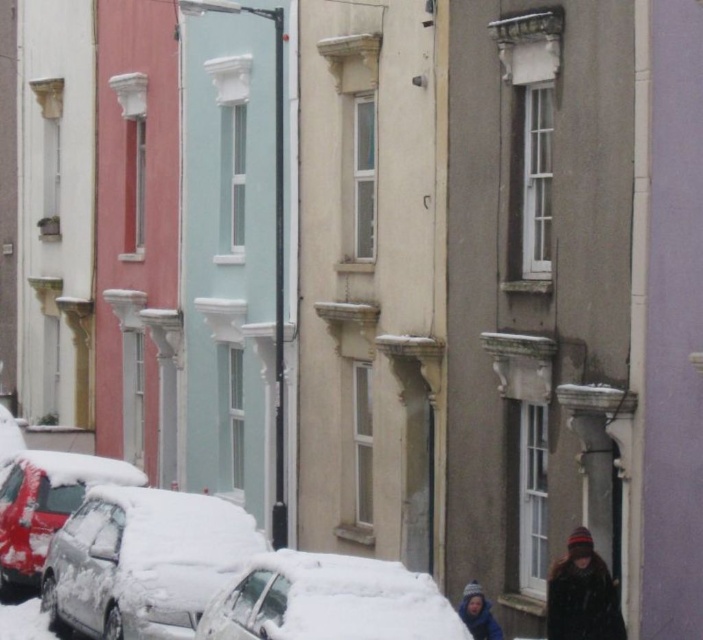
Question: Considering the real-world distances, which object is closest to the shiny red car at lower left?

Choices:
 (A) knitted woolen hat at lower right
 (B) white matte car at lower left

Answer: (B)

Question: Is white matte car at lower left closer to the viewer compared to white snow-covered car at lower center?

Choices:
 (A) no
 (B) yes

Answer: (A)

Question: Where is shiny red car at lower left located in relation to knitted woolen hat at lower right in the image?

Choices:
 (A) left
 (B) right

Answer: (A)

Question: Which of the following is the farthest from the observer?

Choices:
 (A) blue knit hat at lower right
 (B) white matte car at lower left

Answer: (A)

Question: Which object appears closest to the camera in this image?

Choices:
 (A) shiny red car at lower left
 (B) blue knit hat at lower right

Answer: (B)

Question: Does knitted woolen hat at lower right have a smaller size compared to blue knit hat at lower right?

Choices:
 (A) no
 (B) yes

Answer: (A)